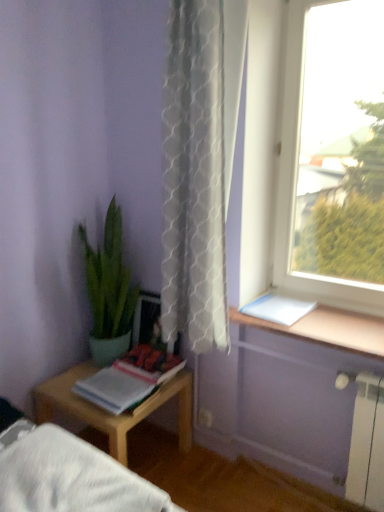
The width and height of the screenshot is (384, 512). What do you see at coordinates (199, 164) in the screenshot?
I see `white textured curtain at center` at bounding box center [199, 164].

The height and width of the screenshot is (512, 384). What do you see at coordinates (109, 413) in the screenshot?
I see `wooden table at left` at bounding box center [109, 413].

What do you see at coordinates (109, 291) in the screenshot? This screenshot has width=384, height=512. I see `green glossy plant at left` at bounding box center [109, 291].

Describe the element at coordinates (278, 308) in the screenshot. I see `white paper at upper right, positioned as the second book in left-to-right order` at that location.

This screenshot has height=512, width=384. I want to click on matte paper book at lower left, the 1th book from the left, so click(129, 379).

The image size is (384, 512). What do you see at coordinates (296, 186) in the screenshot?
I see `transparent glass window at upper right` at bounding box center [296, 186].

Where is `white textured curtain at center`? This screenshot has height=512, width=384. white textured curtain at center is located at coordinates (199, 164).

Identify the location of table on the right of the white fabric bed frame at lower left. Image resolution: width=384 pixels, height=512 pixels. (109, 413).

From the image's perspective, which object appears higher, white fabric bed frame at lower left or wooden table at left?

white fabric bed frame at lower left is shown above in the image.

Is white fabric bed frame at lower left positioned behind wooden table at left?

No, the depth of white fabric bed frame at lower left is less than that of wooden table at left.

Consider the image. Can you tell me how much green glossy plant at left and white paper at upper right, positioned as the second book in left-to-right order, differ in facing direction?

The angle between the facing direction of green glossy plant at left and the facing direction of white paper at upper right, positioned as the second book in left-to-right order, is 0.428 degrees.

Who is taller, green glossy plant at left or white paper at upper right, the first book positioned from the right?

green glossy plant at left.

The image size is (384, 512). Identify the location of houseplant that appears above the white paper at upper right, the first book positioned from the right (from a real-world perspective). (109, 291).

Is green glossy plant at left at the left side of white paper at upper right, marked as the first book in a top-to-bottom arrangement?

Yes.

Visually, is green glossy plant at left positioned to the left or to the right of white textured curtain at center?

green glossy plant at left is to the left of white textured curtain at center.

Does point (122, 304) lie in front of point (190, 274)?

No.

Is the position of green glossy plant at left more distant than that of white textured curtain at center?

That is True.

In the scene shown: How much distance is there between white textured curtain at center and white paper at upper right, positioned as the second book in left-to-right order?

white textured curtain at center is 63.45 centimeters from white paper at upper right, positioned as the second book in left-to-right order.

From the image's perspective, between white textured curtain at center and white paper at upper right, the first book positioned from the right, who is located below?

white paper at upper right, the first book positioned from the right, from the image's perspective.

Does point (194, 202) appear closer or farther from the camera than point (257, 316)?

Clearly, point (194, 202) is closer to the camera than point (257, 316).

Can you confirm if white textured curtain at center is smaller than white paper at upper right, the second book positioned from the bottom?

Incorrect, white textured curtain at center is not smaller in size than white paper at upper right, the second book positioned from the bottom.

Identify the location of table on the right of green glossy plant at left. The height and width of the screenshot is (512, 384). (109, 413).

Considering the positions of objects wooden table at left and green glossy plant at left in the image provided, who is more to the right, wooden table at left or green glossy plant at left?

Positioned to the right is wooden table at left.

How distant is wooden table at left from green glossy plant at left?

They are 14.67 inches apart.

Looking at this image, is wooden table at left bigger or smaller than green glossy plant at left?

In the image, wooden table at left appears to be larger than green glossy plant at left.

Who is shorter, transparent glass window at upper right or green glossy plant at left?

green glossy plant at left is shorter.

Based on the photo, between transparent glass window at upper right and green glossy plant at left, which one appears on the left side from the viewer's perspective?

Positioned to the left is green glossy plant at left.

Can you tell me how much transparent glass window at upper right and green glossy plant at left differ in facing direction?

The angular difference between transparent glass window at upper right and green glossy plant at left is 2.6 degrees.

Would you consider transparent glass window at upper right to be distant from green glossy plant at left?

No, transparent glass window at upper right is not far away from green glossy plant at left.

The image size is (384, 512). In order to click on table on the right of white fabric bed frame at lower left in this screenshot , I will do `click(109, 413)`.

Is wooden table at left facing towards white fabric bed frame at lower left?

No, wooden table at left does not turn towards white fabric bed frame at lower left.

Are wooden table at left and white fabric bed frame at lower left located far from each other?

Actually, wooden table at left and white fabric bed frame at lower left are a little close together.

This screenshot has height=512, width=384. In order to click on table below the white fabric bed frame at lower left (from a real-world perspective) in this screenshot , I will do `click(109, 413)`.

Where is `the 1st book in front when counting from the green glossy plant at left`? the 1st book in front when counting from the green glossy plant at left is located at coordinates (278, 308).

Based on their spatial positions, is transparent glass window at upper right or green glossy plant at left closer to white paper at upper right, the second book positioned from the bottom?

transparent glass window at upper right is positioned closer to the anchor white paper at upper right, the second book positioned from the bottom.

Which object lies further to the anchor point green glossy plant at left, white paper at upper right, positioned as the second book in left-to-right order, or transparent glass window at upper right?

transparent glass window at upper right lies further to green glossy plant at left than the other object.

Estimate the real-world distances between objects in this image. Which object is closer to white fabric bed frame at lower left, transparent glass window at upper right or wooden table at left?

The object closer to white fabric bed frame at lower left is wooden table at left.

Considering their positions, is white fabric bed frame at lower left positioned further to white textured curtain at center than matte paper book at lower left, the 1th book from the left?

The object further to white textured curtain at center is white fabric bed frame at lower left.

Estimate the real-world distances between objects in this image. Which object is further from transparent glass window at upper right, green glossy plant at left or wooden table at left?

wooden table at left is further to transparent glass window at upper right.

Considering their positions, is white paper at upper right, positioned as the second book in left-to-right order, positioned closer to transparent glass window at upper right than matte paper book at lower left, which ranks as the 1th book in bottom-to-top order?

white paper at upper right, positioned as the second book in left-to-right order, lies closer to transparent glass window at upper right than the other object.

Considering their positions, is wooden table at left positioned closer to transparent glass window at upper right than white paper at upper right, the second book positioned from the bottom?

white paper at upper right, the second book positioned from the bottom.

Which object lies further to the anchor point white textured curtain at center, green glossy plant at left or white fabric bed frame at lower left?

white fabric bed frame at lower left is further to white textured curtain at center.

Where is `book positioned between white fabric bed frame at lower left and white paper at upper right, marked as the first book in a top-to-bottom arrangement, from near to far`? This screenshot has width=384, height=512. book positioned between white fabric bed frame at lower left and white paper at upper right, marked as the first book in a top-to-bottom arrangement, from near to far is located at coordinates (129, 379).

I want to click on curtain between transparent glass window at upper right and matte paper book at lower left, the 2th book viewed from the right, in the up-down direction, so click(199, 164).

At what (x,y) coordinates should I click in order to perform the action: click on curtain located between green glossy plant at left and transparent glass window at upper right in the left-right direction. Please return your answer as a coordinate pair (x, y). The width and height of the screenshot is (384, 512). Looking at the image, I should click on (199, 164).

Find the location of a particular element. This screenshot has width=384, height=512. bed frame between green glossy plant at left and transparent glass window at upper right is located at coordinates (71, 477).